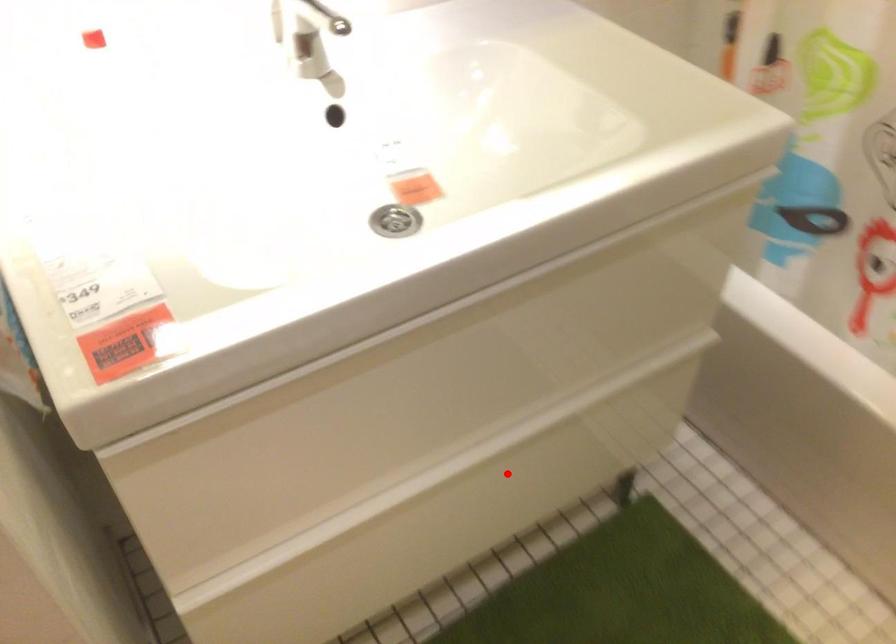
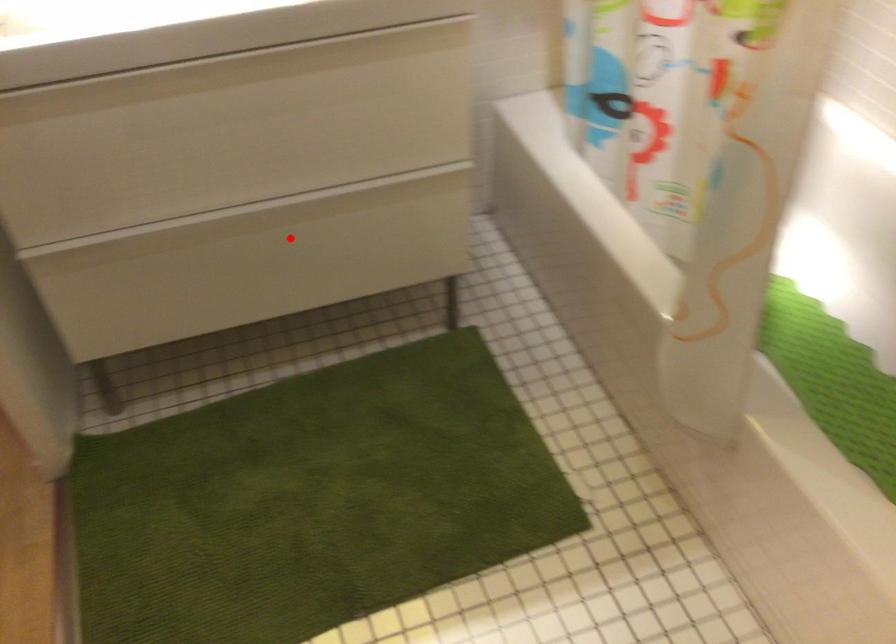
I am providing you with two images of the same scene from different viewpoints. A red point is marked on the first image and another point is marked on the second image. Is the marked point in image1 the same physical position as the marked point in image2?

Yes